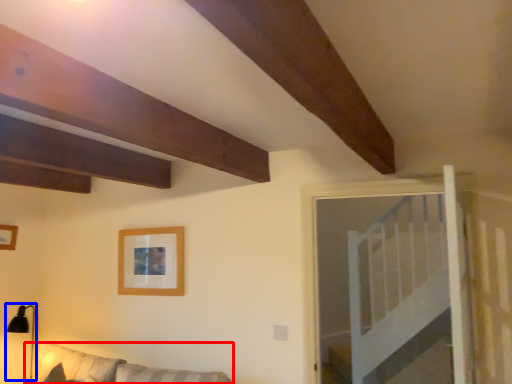
Question: Among these objects, which one is nearest to the camera, couch (highlighted by a red box) or lamp (highlighted by a blue box)?

Choices:
 (A) couch
 (B) lamp

Answer: (A)